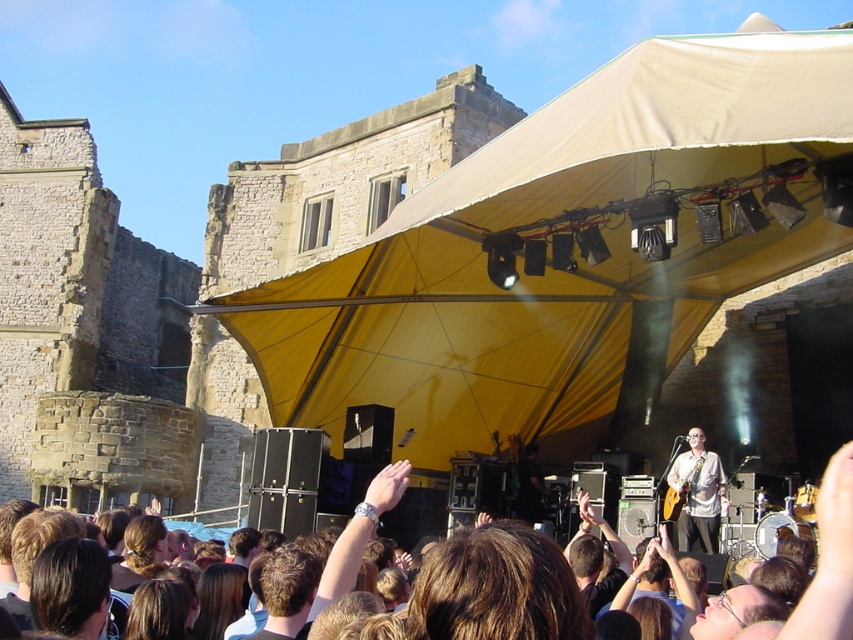
Does yellow fabric canopy at upper center have a smaller size compared to light brown wood guitar at center?

No.

What do you see at coordinates (567, 248) in the screenshot? I see `yellow fabric canopy at upper center` at bounding box center [567, 248].

Does point (660, 166) come closer to viewer compared to point (686, 461)?

Yes, it is in front of point (686, 461).

The height and width of the screenshot is (640, 853). Find the location of `yellow fabric canopy at upper center`. yellow fabric canopy at upper center is located at coordinates (567, 248).